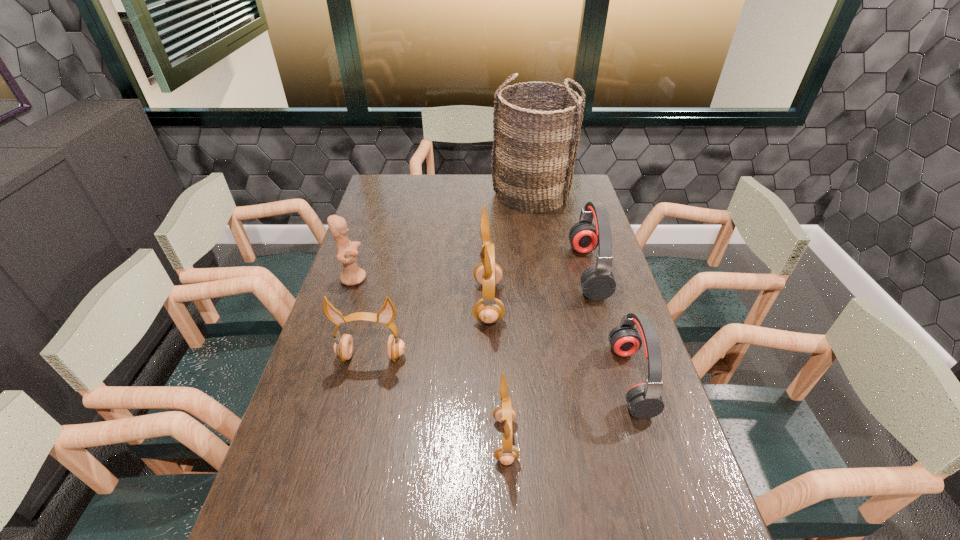
At what (x,y) coordinates should I click in order to perform the action: click on free space that satisfies the following two spatial constraints: 1. on the ear cups of the farther red earphone; 2. on the front-facing side of the second smallest brown earphone. Please return your answer as a coordinate pair (x, y). Looking at the image, I should click on (612, 357).

Image resolution: width=960 pixels, height=540 pixels. I want to click on vacant area that satisfies the following two spatial constraints: 1. on the ear cups of the bigger red earphone; 2. on the front-facing side of the second nearest brown earphone, so click(612, 357).